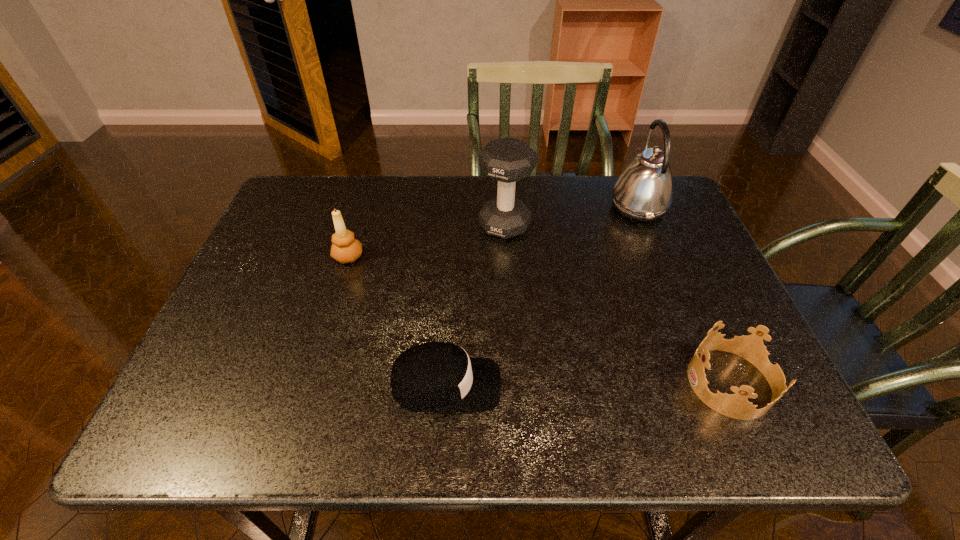
I want to click on vacant space that is in between the third shortest object and the tiara, so click(540, 320).

This screenshot has width=960, height=540. Find the location of `vacant point located between the cap and the dumbbell`. vacant point located between the cap and the dumbbell is located at coordinates [475, 305].

Find the location of `free space that is in between the kettle and the tiara`. free space that is in between the kettle and the tiara is located at coordinates (684, 295).

At what (x,y) coordinates should I click in order to perform the action: click on vacant space in between the dumbbell and the kettle. Please return your answer as a coordinate pair (x, y). Looking at the image, I should click on (571, 216).

This screenshot has height=540, width=960. Identify the location of blank region between the third nearest object and the dumbbell. (426, 241).

The image size is (960, 540). In order to click on free space between the dumbbell and the cap in this screenshot , I will do `click(475, 305)`.

Identify which object is the fourth nearest to the tiara. Please provide its 2D coordinates. Your answer should be formatted as a tuple, i.e. [(x, y)], where the tuple contains the x and y coordinates of a point satisfying the conditions above.

[(345, 248)]

Locate which object ranks third in proximity to the cap. Please provide its 2D coordinates. Your answer should be formatted as a tuple, i.e. [(x, y)], where the tuple contains the x and y coordinates of a point satisfying the conditions above.

[(751, 347)]

Identify the location of vacant region that satisfies the following two spatial constraints: 1. from the spout of the kettle; 2. on the front side of the third tallest object. (658, 256).